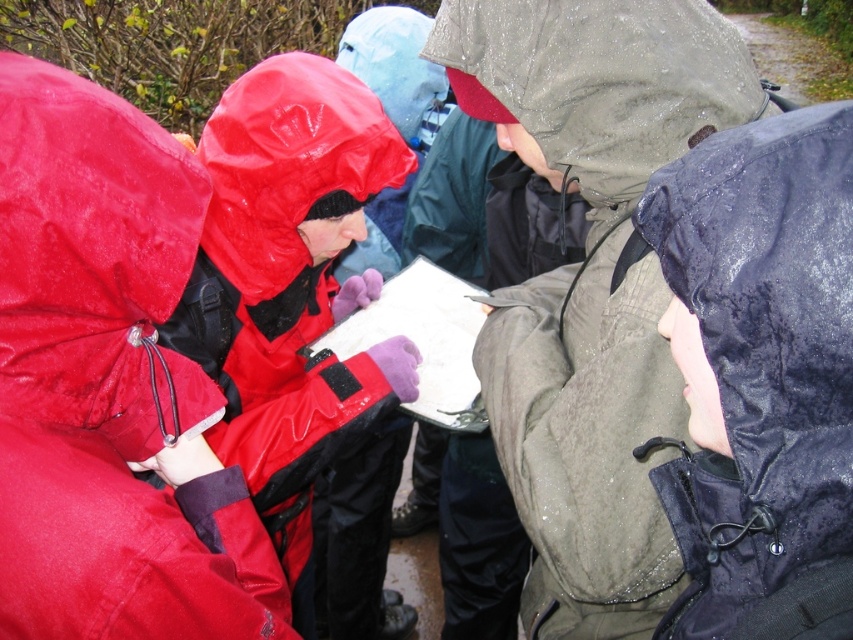
You are a photographer trying to capture a clear shot of the shiny dark blue jacket at lower right and the rubberized red jacket at left. Since you want both jackets to appear equally prominent in the photo, which jacket should you zoom in on more, and why?

The shiny dark blue jacket at lower right has a lesser height compared to the rubberized red jacket at left. To make them appear equally prominent, you should zoom in more on the shiny dark blue jacket at lower right to compensate for its smaller size.

You are a photographer trying to capture a clear shot of both the matte green jacket at center and the rubberized red jacket at left. Since you can only focus on one subject at a time, which jacket should you focus on first to ensure the other remains in the background?

You should focus on the matte green jacket at center first because it is closer to the viewer than the rubberized red jacket at left, so if you focus on it, the farther jacket will naturally stay in the background.